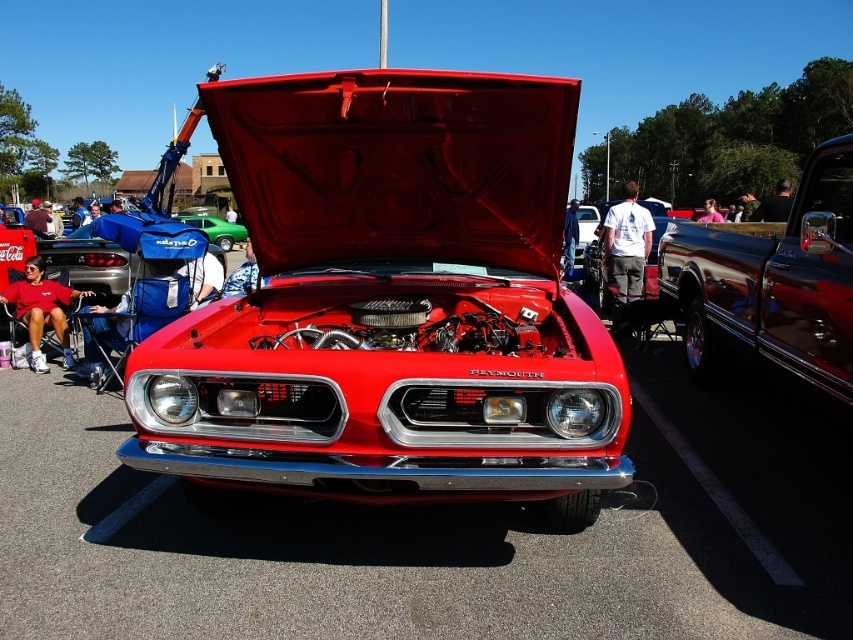
You are standing at the center of the parking lot and see the point labeled as point [772,285]. What object is located at that point?

The point [772,285] corresponds to the glossy dark brown truck at right.

You are a photographer wanting to capture both the shiny red car at center and the glossy dark brown truck at right in a single shot. Based on their positions, which vehicle should you focus on first to ensure both are in frame?

The shiny red car at center is in front of the glossy dark brown truck at right, so you should focus on the shiny red car at center first to ensure both are in frame.

You are a photographer at the car show. You want to take a photo of both the shiny red car at center and the glossy dark brown truck at right in the same frame. Which vehicle should you position closer to the camera to ensure both appear balanced in size?

To balance the sizes in the photo, position the shiny red car at center closer to the camera since it is smaller than the glossy dark brown truck at right. This way, the smaller car will appear larger in the frame, matching the size of the truck.